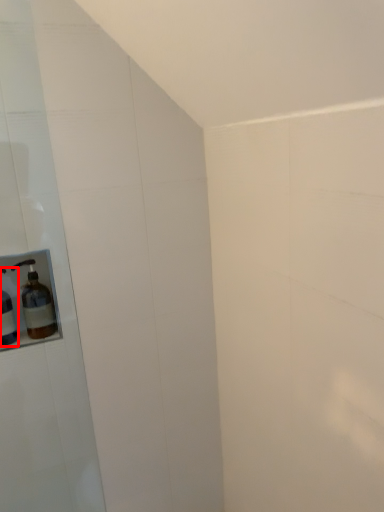
Question: From the image's perspective, where is bottle (annotated by the red box) located in relation to bottle in the image?

Choices:
 (A) below
 (B) above

Answer: (A)